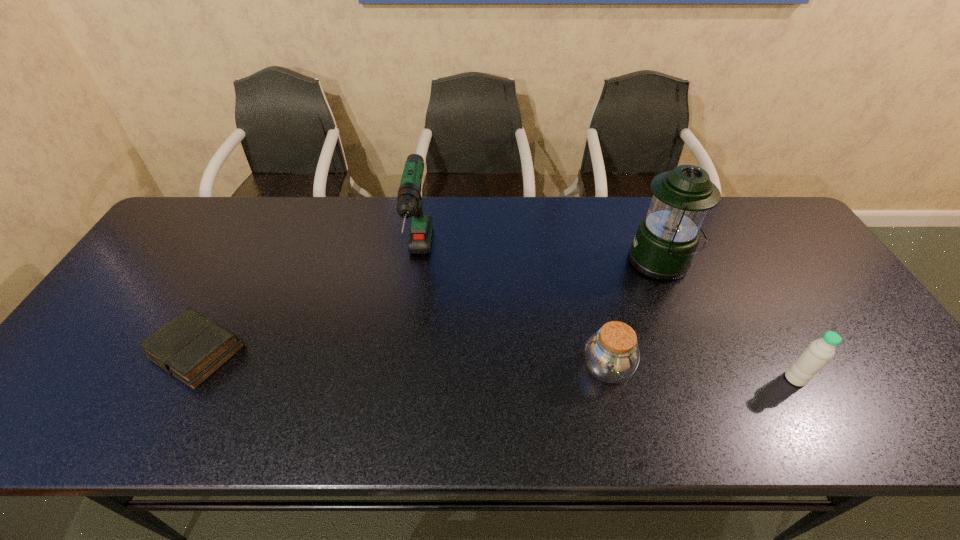
I want to click on vacant area situated 0.130m on the back of the third tallest object, so click(765, 326).

Identify the location of vacant space positioned on the back of the third object from right to left. The width and height of the screenshot is (960, 540). (580, 253).

Locate an element on the screen. vacant space located 0.180m on the back of the book is located at coordinates pos(241,268).

The width and height of the screenshot is (960, 540). I want to click on lantern at the far edge, so click(667, 237).

Identify the location of drill situated at the far edge. (409, 201).

In the image, there is a desktop. What are the coordinates of `vacant space at the far edge` in the screenshot? It's located at (240, 221).

The height and width of the screenshot is (540, 960). In order to click on free spot at the near edge of the desktop in this screenshot , I will do `click(576, 403)`.

Locate an element on the screen. Image resolution: width=960 pixels, height=540 pixels. free spot at the right edge of the desktop is located at coordinates (819, 281).

Find the location of a particular element. vacant space at the near left corner of the desktop is located at coordinates (29, 428).

Image resolution: width=960 pixels, height=540 pixels. Identify the location of vacant space at the near right corner of the desktop. (926, 421).